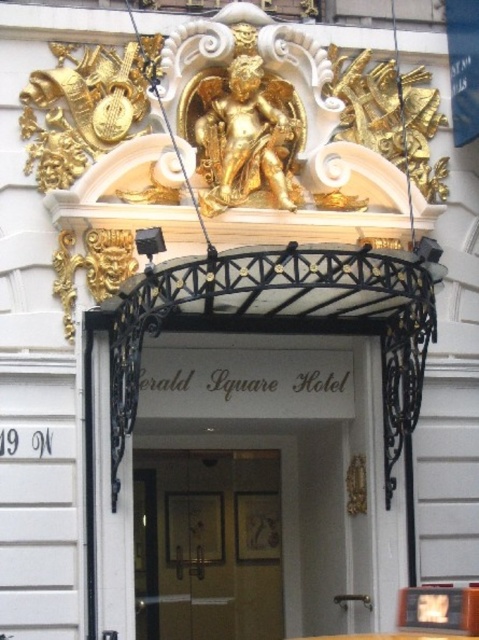
Who is positioned more to the left, white glossy door at center or wooden door at center?

wooden door at center is more to the left.

Is point (103, 522) farther from viewer compared to point (174, 561)?

No.

Is point (231, 508) more distant than point (263, 544)?

No, (231, 508) is in front of (263, 544).

The image size is (479, 640). I want to click on white glossy door at center, so click(240, 486).